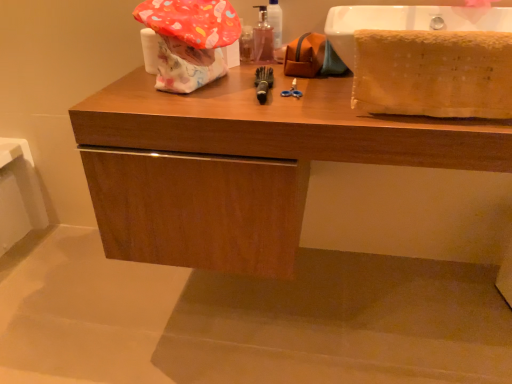
The width and height of the screenshot is (512, 384). What do you see at coordinates (263, 83) in the screenshot?
I see `black rubber toothbrush at center` at bounding box center [263, 83].

What do you see at coordinates (263, 38) in the screenshot? The width and height of the screenshot is (512, 384). I see `translucent plastic mouthwash at center` at bounding box center [263, 38].

Locate an element on the screen. The height and width of the screenshot is (384, 512). black rubber toothbrush at center is located at coordinates click(263, 83).

From a real-world perspective, between black rubber toothbrush at center and soft yellow towel at right, who is vertically lower?

black rubber toothbrush at center, from a real-world perspective.

How distant is black rubber toothbrush at center from soft yellow towel at right?

black rubber toothbrush at center is 13.65 inches from soft yellow towel at right.

Is black rubber toothbrush at center directly adjacent to soft yellow towel at right?

black rubber toothbrush at center and soft yellow towel at right are not in contact.

Is black rubber toothbrush at center oriented towards soft yellow towel at right?

No, black rubber toothbrush at center is not aimed at soft yellow towel at right.

Looking at this image, from the image's perspective, between soft yellow towel at right and translucent plastic mouthwash at center, who is located below?

soft yellow towel at right, from the image's perspective.

Which is more to the left, soft yellow towel at right or translucent plastic mouthwash at center?

From the viewer's perspective, translucent plastic mouthwash at center appears more on the left side.

From the picture: Would you say soft yellow towel at right is outside translucent plastic mouthwash at center?

Yes.

From a real-world perspective, is wooden cabinet at center below soft yellow towel at right?

Yes, from a real-world perspective, wooden cabinet at center is beneath soft yellow towel at right.

Is wooden cabinet at center surrounding soft yellow towel at right?

No, soft yellow towel at right is located outside of wooden cabinet at center.

Is there a large distance between wooden cabinet at center and soft yellow towel at right?

wooden cabinet at center is near soft yellow towel at right, not far away.

How much distance is there between wooden cabinet at center and soft yellow towel at right?

wooden cabinet at center is 10.54 inches away from soft yellow towel at right.

Is translucent plastic mouthwash at center positioned with its back to wooden cabinet at center?

translucent plastic mouthwash at center is not turned away from wooden cabinet at center.

Is translucent plastic mouthwash at center located outside wooden cabinet at center?

Yes, translucent plastic mouthwash at center is outside of wooden cabinet at center.

Between translucent plastic mouthwash at center and wooden cabinet at center, which one has more height?

Standing taller between the two is wooden cabinet at center.

What's the angular difference between translucent plastic mouthwash at center and wooden cabinet at center's facing directions?

The angle between the facing direction of translucent plastic mouthwash at center and the facing direction of wooden cabinet at center is 5.48 degrees.

Does black rubber toothbrush at center turn towards translucent plastic mouthwash at center?

No, black rubber toothbrush at center is not turned towards translucent plastic mouthwash at center.

Is point (270, 80) more distant than point (262, 22)?

No, it is not.

Measure the distance from black rubber toothbrush at center to translucent plastic mouthwash at center.

They are 20.19 centimeters apart.

Looking at the image, does black rubber toothbrush at center seem bigger or smaller compared to translucent plastic mouthwash at center?

black rubber toothbrush at center is bigger than translucent plastic mouthwash at center.

Would you consider translucent plastic mouthwash at center to be distant from soft yellow towel at right?

No, translucent plastic mouthwash at center is not far away from soft yellow towel at right.

From a real-world perspective, who is located higher, translucent plastic mouthwash at center or soft yellow towel at right?

In real-world perspective, translucent plastic mouthwash at center is above.

In terms of size, does translucent plastic mouthwash at center appear bigger or smaller than soft yellow towel at right?

In the image, translucent plastic mouthwash at center appears to be smaller than soft yellow towel at right.

How much distance is there between translucent plastic mouthwash at center and black rubber toothbrush at center?

translucent plastic mouthwash at center and black rubber toothbrush at center are 20.19 centimeters apart from each other.

Is point (267, 21) farther from viewer compared to point (259, 74)?

Yes, it is behind point (259, 74).

Considering their positions, is translucent plastic mouthwash at center located in front of or behind black rubber toothbrush at center?

translucent plastic mouthwash at center is behind black rubber toothbrush at center.

Where is `tool that is on the left side of translucent plastic mouthwash at center`? The image size is (512, 384). tool that is on the left side of translucent plastic mouthwash at center is located at coordinates (263, 83).

Locate an element on the screen. blanket that is in front of the black rubber toothbrush at center is located at coordinates (433, 73).

Identify the location of blanket on the right of translucent plastic mouthwash at center. This screenshot has height=384, width=512. (433, 73).

Considering their positions, is black rubber toothbrush at center positioned closer to soft yellow towel at right than wooden cabinet at center?

wooden cabinet at center is positioned closer to the anchor soft yellow towel at right.

From the image, which object appears to be farther from wooden cabinet at center, soft yellow towel at right or black rubber toothbrush at center?

Among the two, soft yellow towel at right is located further to wooden cabinet at center.

When comparing their distances from soft yellow towel at right, does translucent plastic mouthwash at center or wooden cabinet at center seem further?

Based on the image, translucent plastic mouthwash at center appears to be further to soft yellow towel at right.

Estimate the real-world distances between objects in this image. Which object is closer to soft yellow towel at right, wooden cabinet at center or black rubber toothbrush at center?

wooden cabinet at center is positioned closer to the anchor soft yellow towel at right.

When comparing their distances from translucent plastic mouthwash at center, does wooden cabinet at center or black rubber toothbrush at center seem further?

Among the two, wooden cabinet at center is located further to translucent plastic mouthwash at center.

From the image, which object appears to be farther from translucent plastic mouthwash at center, black rubber toothbrush at center or soft yellow towel at right?

Among the two, soft yellow towel at right is located further to translucent plastic mouthwash at center.

Looking at the image, which one is located closer to wooden cabinet at center, translucent plastic mouthwash at center or black rubber toothbrush at center?

Among the two, black rubber toothbrush at center is located nearer to wooden cabinet at center.

From the image, which object appears to be nearer to translucent plastic mouthwash at center, soft yellow towel at right or wooden cabinet at center?

Among the two, wooden cabinet at center is located nearer to translucent plastic mouthwash at center.

Find the location of a particular element. The width and height of the screenshot is (512, 384). tool positioned between soft yellow towel at right and translucent plastic mouthwash at center from near to far is located at coordinates (263, 83).

You are a GUI agent. You are given a task and a screenshot of the screen. Output one action in this format:
    pyautogui.click(x=<x>, y=<y>)
    Task: Click on the blanket positioned between wooden cabinet at center and translucent plastic mouthwash at center from near to far
    The width and height of the screenshot is (512, 384).
    Given the screenshot: What is the action you would take?
    pyautogui.click(x=433, y=73)

You are a GUI agent. You are given a task and a screenshot of the screen. Output one action in this format:
    pyautogui.click(x=<x>, y=<y>)
    Task: Click on the tool between wooden cabinet at center and translucent plastic mouthwash at center in the front-back direction
    Image resolution: width=512 pixels, height=384 pixels.
    Given the screenshot: What is the action you would take?
    pyautogui.click(x=263, y=83)

Where is `bathroom cabinet between black rubber toothbrush at center and soft yellow towel at right in the horizontal direction`? This screenshot has height=384, width=512. bathroom cabinet between black rubber toothbrush at center and soft yellow towel at right in the horizontal direction is located at coordinates (242, 165).